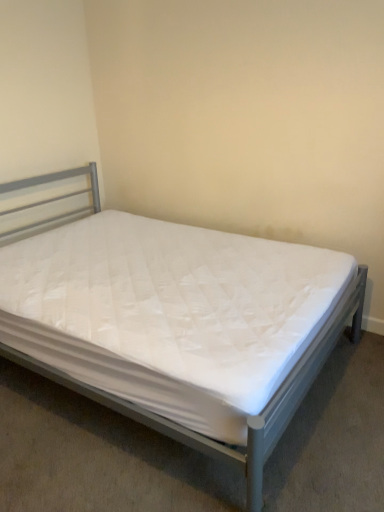
Where is `matte white mattress at center`? matte white mattress at center is located at coordinates (178, 324).

Describe the element at coordinates (178, 324) in the screenshot. Image resolution: width=384 pixels, height=512 pixels. I see `matte white mattress at center` at that location.

You are a GUI agent. You are given a task and a screenshot of the screen. Output one action in this format:
    pyautogui.click(x=<x>, y=<y>)
    Task: Click on the matte white mattress at center
    Image resolution: width=384 pixels, height=512 pixels.
    Given the screenshot: What is the action you would take?
    [178, 324]